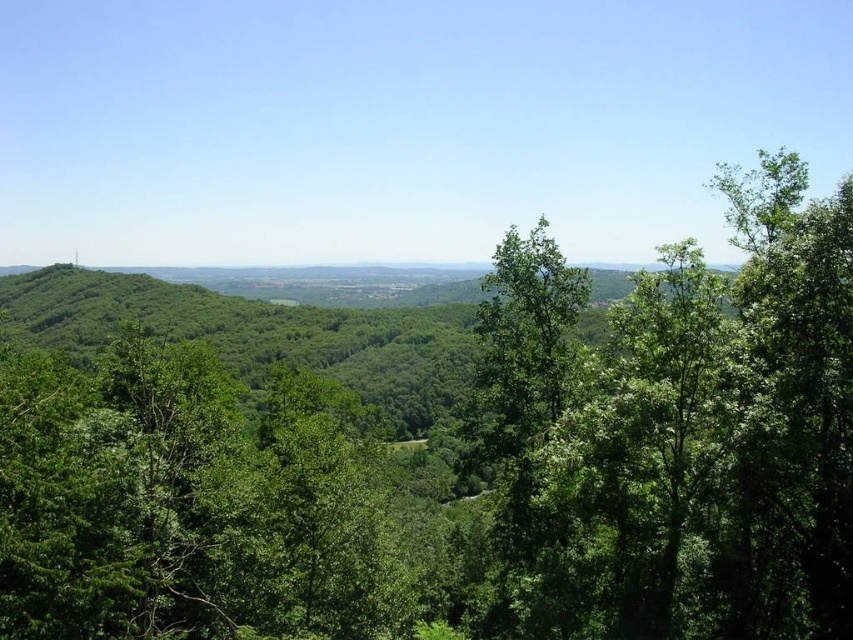
Question: Is green leafy tree at upper right positioned before green leafy tree at center?

Choices:
 (A) no
 (B) yes

Answer: (A)

Question: Which object is farther from the camera taking this photo?

Choices:
 (A) green leafy tree at center
 (B) green leafy tree at upper right

Answer: (B)

Question: Which of the following is the closest to the observer?

Choices:
 (A) green leafy tree at upper right
 (B) green leafy tree at center

Answer: (B)

Question: Is green leafy tree at upper right to the left of green leafy tree at center from the viewer's perspective?

Choices:
 (A) yes
 (B) no

Answer: (B)

Question: Is green leafy tree at upper right to the right of green leafy tree at center from the viewer's perspective?

Choices:
 (A) no
 (B) yes

Answer: (B)